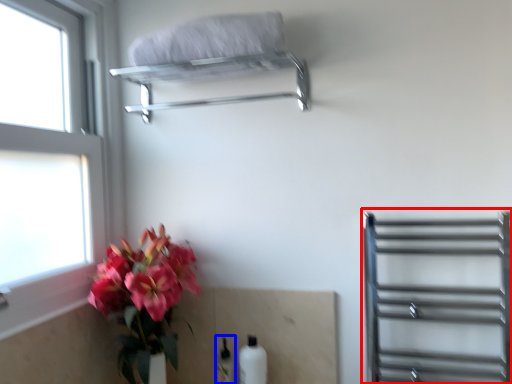
Question: Which object appears closest to the camera in this image, shelf (highlighted by a red box) or bottle (highlighted by a blue box)?

Choices:
 (A) shelf
 (B) bottle

Answer: (A)